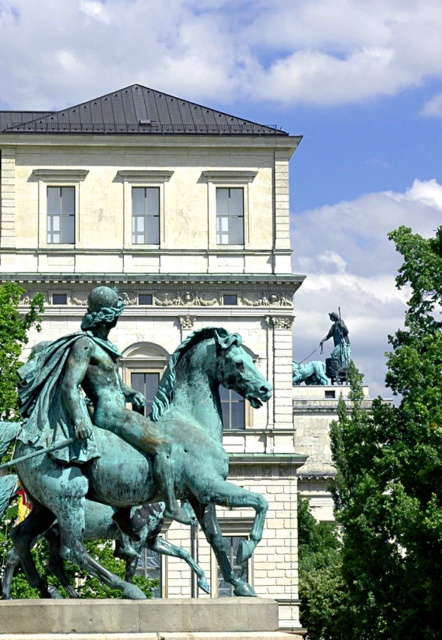
This screenshot has height=640, width=442. What do you see at coordinates (167, 260) in the screenshot?
I see `matte bronze palace at center` at bounding box center [167, 260].

Who is more distant from viewer, (x=80, y=241) or (x=331, y=376)?

Point (x=331, y=376)

This screenshot has width=442, height=640. I want to click on matte bronze palace at center, so click(167, 260).

Which is below, green patina horse at center or bronze statue at center?

green patina horse at center is below.

Based on the photo, does green patina horse at center lie behind bronze statue at center?

That is False.

Where is `green patina horse at center`? The width and height of the screenshot is (442, 640). green patina horse at center is located at coordinates (209, 433).

Image resolution: width=442 pixels, height=640 pixels. I want to click on green patina horse at center, so click(x=209, y=433).

Is point (281, 512) farther from camera compared to point (88, 488)?

Yes, point (281, 512) is farther from viewer.

At what (x,y) coordinates should I click in order to perform the action: click on matte bronze palace at center. Please return your answer as a coordinate pair (x, y). The image size is (442, 640). Looking at the image, I should click on (167, 260).

The width and height of the screenshot is (442, 640). Identify the location of matte bronze palace at center. point(167,260).